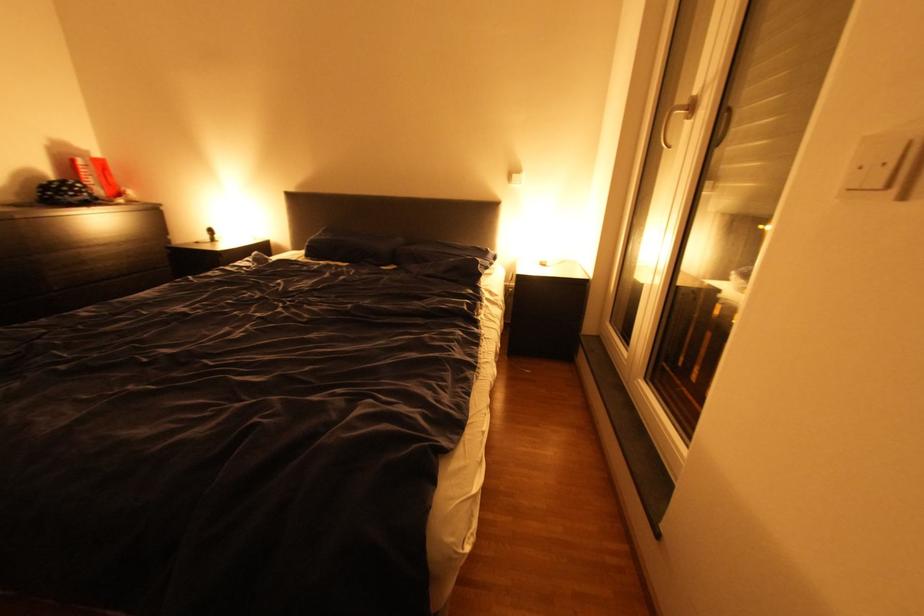
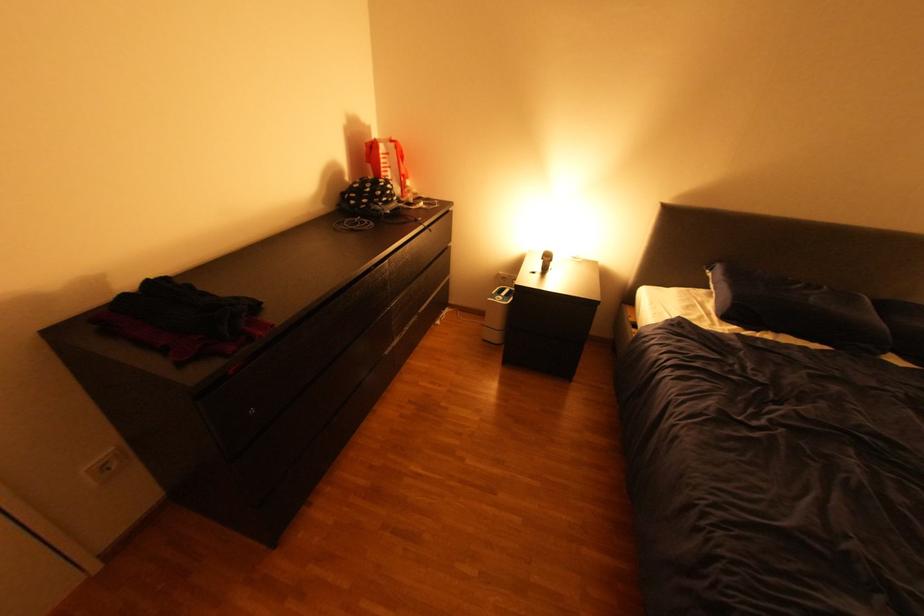
Find the pixel in the second image that matches (96,152) in the first image.

(379, 129)